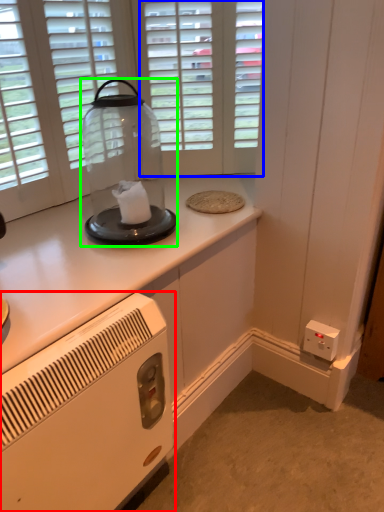
Question: Considering the real-world distances, which object is closest to home appliance (highlighted by a red box)? glass door (highlighted by a blue box) or glass jar (highlighted by a green box).

Choices:
 (A) glass door
 (B) glass jar

Answer: (B)